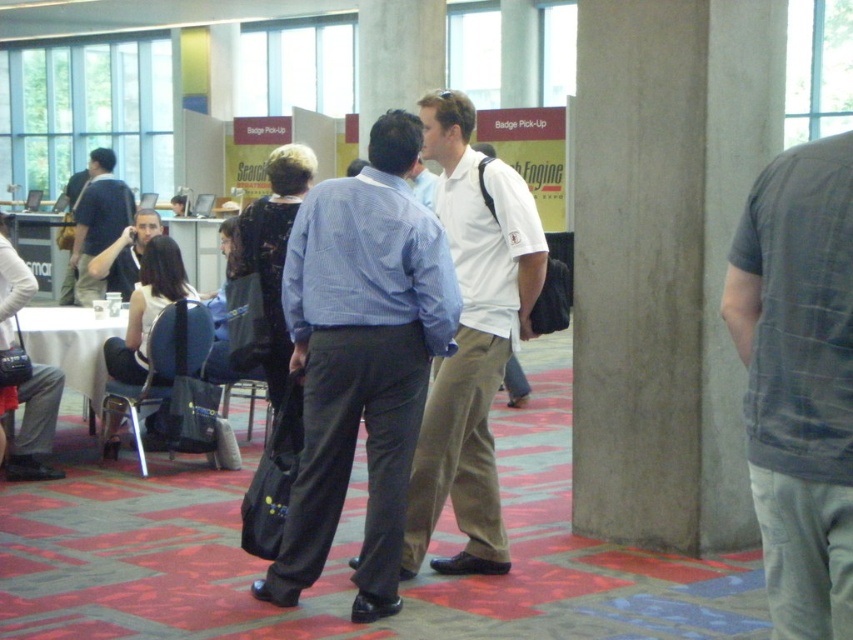
You are standing in the conference room and want to find the gray plaid shirt at center. Based on its 2D coordinates, where should you look relative to the image frame?

The gray plaid shirt at center is located at the 2D coordinates point 0.595 on the horizontal axis and 0.938 on the vertical axis within the image frame.

You are standing in the conference space and want to take a photo of both the point at coordinates (627, 161) and the point at coordinates (148, 216). Which point will appear larger in your photo?

The point at coordinates (627, 161) will appear larger in the photo because it is closer to the camera than the point at coordinates (148, 216).

You are organizing a small event and need to move a 3.5 meter long banner between the white cotton shirt at center and the matte black shirt at left. Is there enough space for the banner to pass through without touching either shirt?

The distance between the white cotton shirt at center and the matte black shirt at left is 3.84 meters, which is greater than the 3.5 meter length of the banner. Therefore, there is sufficient space for the banner to pass through without touching either shirt.